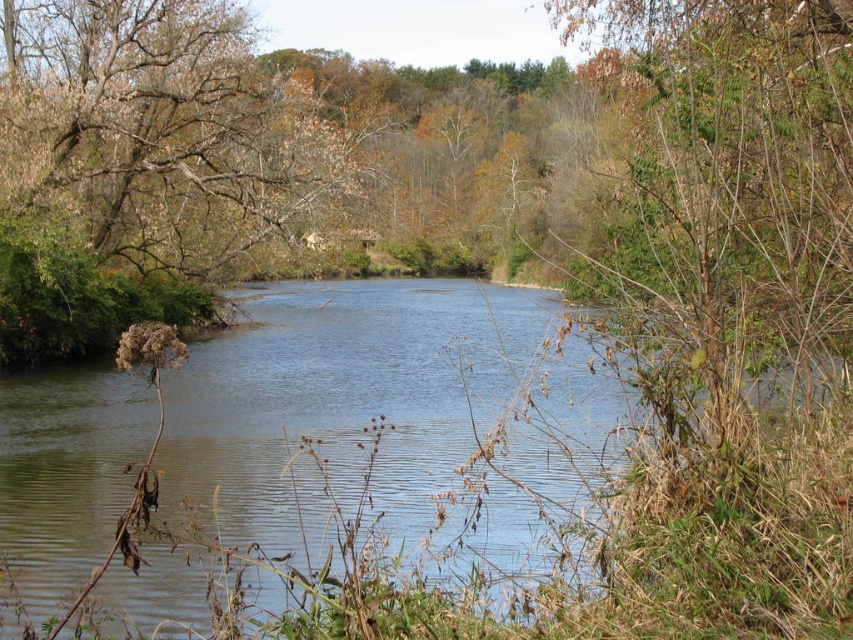
Who is positioned more to the right, clear water at center or brown leafy tree at upper left?

clear water at center

Which is below, clear water at center or brown leafy tree at upper left?

Positioned lower is clear water at center.

Locate an element on the screen. The height and width of the screenshot is (640, 853). clear water at center is located at coordinates (378, 406).

Identify the location of clear water at center. (378, 406).